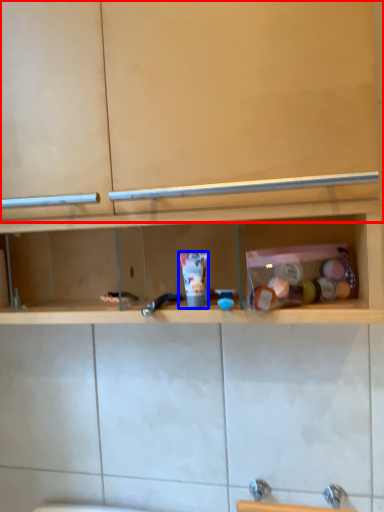
Question: Among these objects, which one is farthest to the camera, cabinet (highlighted by a red box) or toiletry (highlighted by a blue box)?

Choices:
 (A) cabinet
 (B) toiletry

Answer: (B)